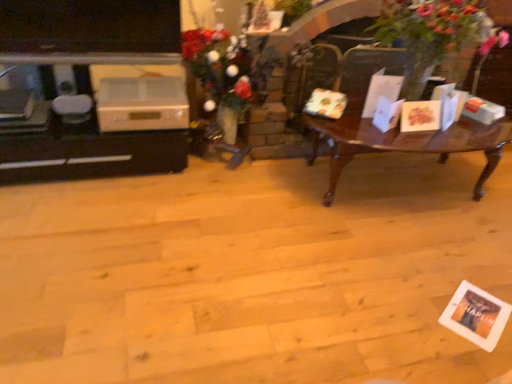
Question: Is green leafy plant at right in front of or behind white glossy entertainment center at left in the image?

Choices:
 (A) front
 (B) behind

Answer: (A)

Question: Would you say green leafy plant at right is to the left or to the right of white glossy entertainment center at left in the picture?

Choices:
 (A) left
 (B) right

Answer: (B)

Question: Considering the real-world distances, which object is farthest from the green leafy plant at right?

Choices:
 (A) floral bouquet at center
 (B) white glossy entertainment center at left
 (C) woodenwoodencoffee table at right
 (D) white plastic appliance at left

Answer: (B)

Question: Considering the real-world distances, which object is closest to the white plastic appliance at left?

Choices:
 (A) woodenwoodencoffee table at right
 (B) white glossy entertainment center at left
 (C) floral bouquet at center
 (D) green leafy plant at right

Answer: (B)